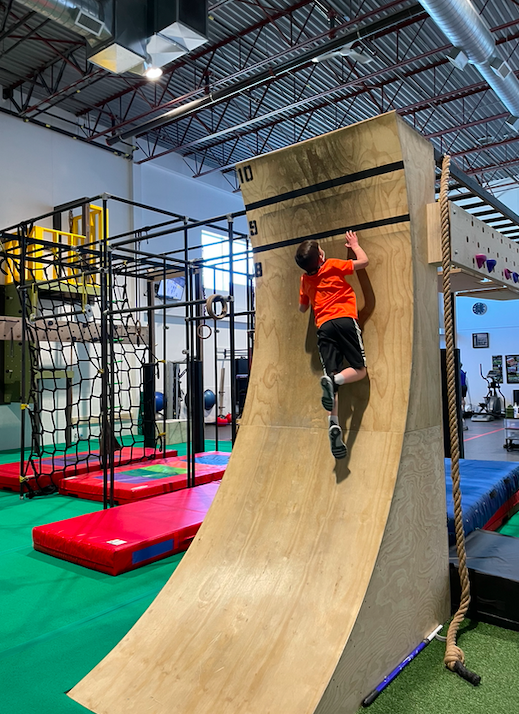
The height and width of the screenshot is (714, 519). I want to click on vent, so click(89, 25), click(507, 73).